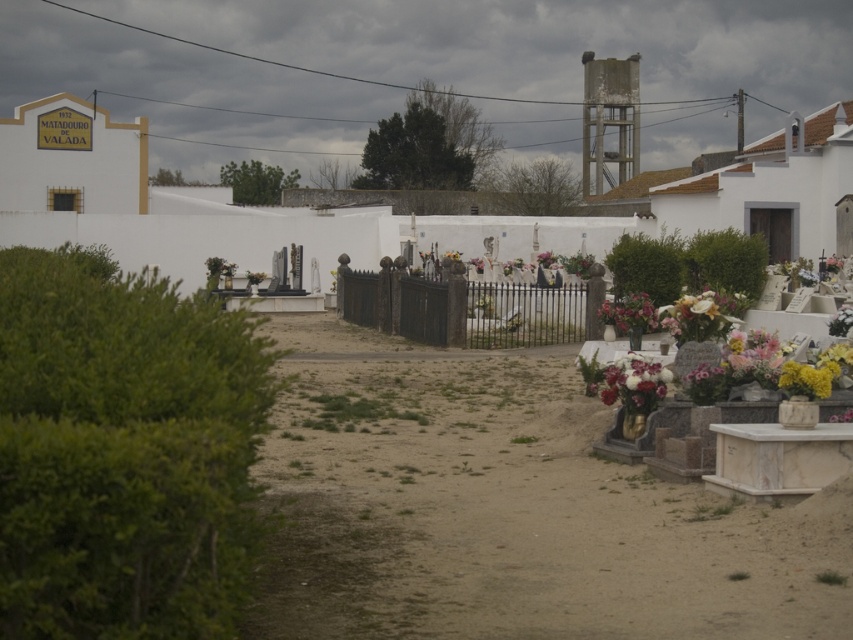
You are a groundskeeper in the cemetery and need to place a new flowerpot between the black wrought iron fence at center and the white floral bouquet at lower right. Which object should you move closer to you to create space?

To create space between the black wrought iron fence at center and the white floral bouquet at lower right, you should move the white floral bouquet at lower right closer to you since the black wrought iron fence at center is already further away from you.

You are a photographer standing at the entrance of the cemetery. You want to take a photo that includes both the black wrought iron fence at center and the white floral bouquet at lower right. Which object will appear taller in the photo?

The white floral bouquet at lower right will appear taller in the photo because it is taller than the black wrought iron fence at center.